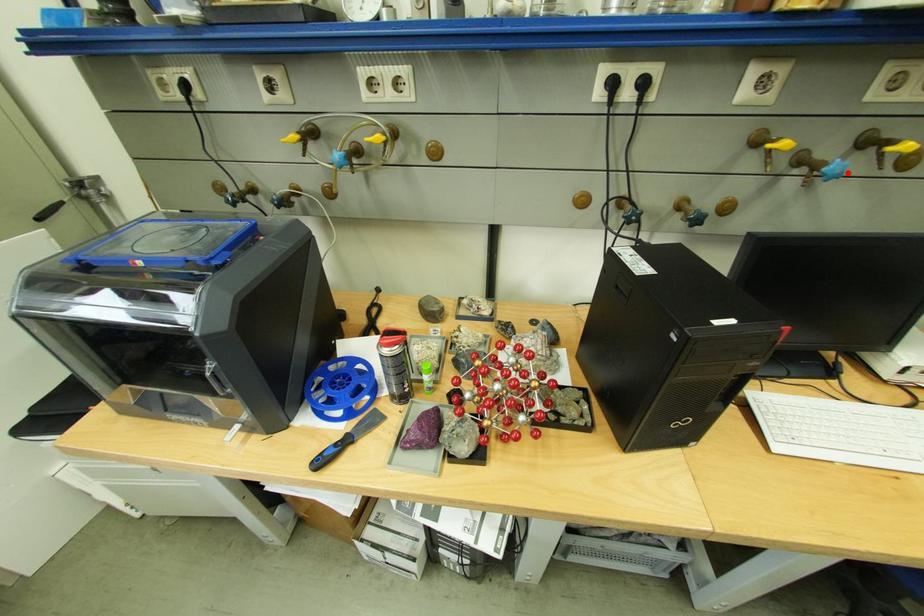
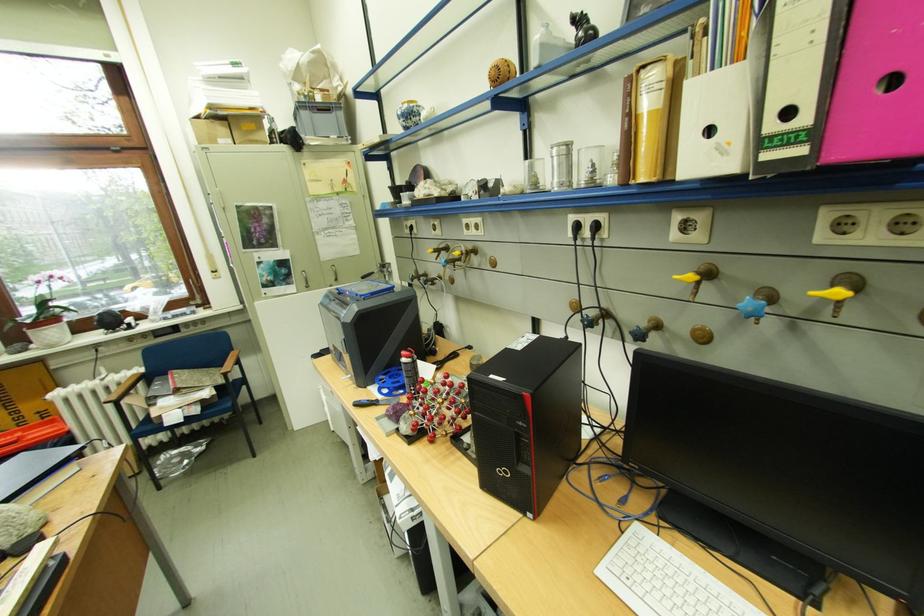
Where in the second image is the point corresponding to the highlighted location from the first image?

(760, 310)